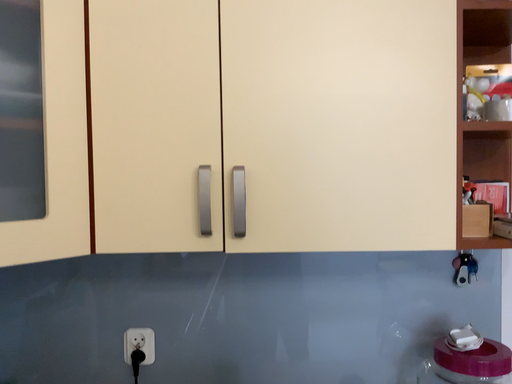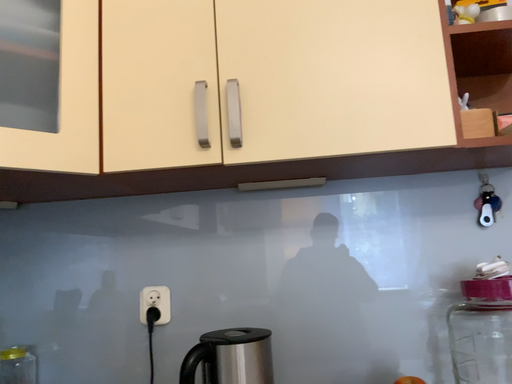
Question: How did the camera likely rotate when shooting the video?

Choices:
 (A) rotated left
 (B) rotated right

Answer: (A)